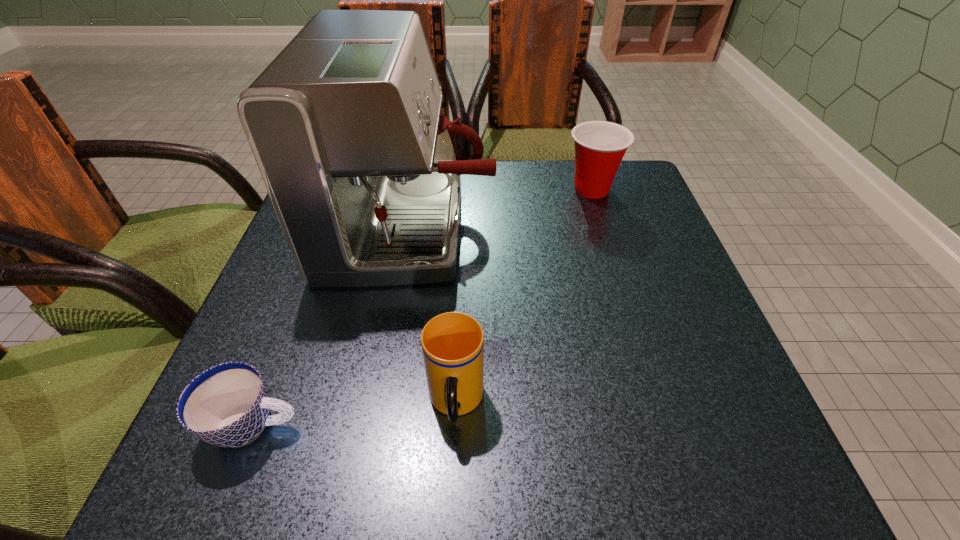
Identify the location of the tallest object. The height and width of the screenshot is (540, 960). (345, 124).

At what (x,y) coordinates should I click in order to perform the action: click on the rightmost cup. Please return your answer as a coordinate pair (x, y). Looking at the image, I should click on (600, 146).

This screenshot has height=540, width=960. What are the coordinates of `the farthest cup` in the screenshot? It's located at (600, 146).

Locate an element on the screen. This screenshot has width=960, height=540. the second cup from left to right is located at coordinates (452, 343).

The width and height of the screenshot is (960, 540). Identify the location of the shortest cup. (227, 405).

This screenshot has width=960, height=540. I want to click on the leftmost cup, so click(227, 405).

The image size is (960, 540). What are the coordinates of `free space located 0.130m on the front of the coffee maker near the spout` in the screenshot? It's located at (553, 228).

Locate an element on the screen. vacant space situated on the left of the farthest cup is located at coordinates (522, 189).

Where is `free space located on the side of the second cup from left to right with the handle`? This screenshot has height=540, width=960. free space located on the side of the second cup from left to right with the handle is located at coordinates (452, 485).

Find the location of a particular element. The width and height of the screenshot is (960, 540). free location located 0.280m on the side of the leftmost cup with the handle is located at coordinates (495, 425).